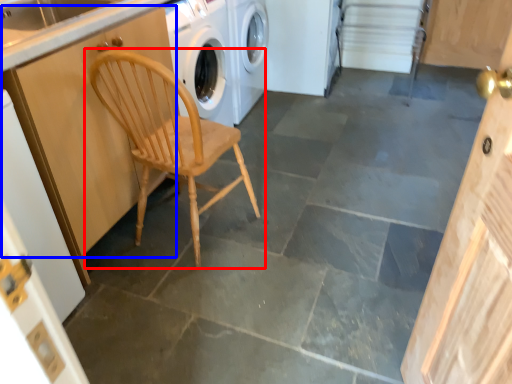
Question: Which of the following is the farthest to the observer, chair (highlighted by a red box) or cabinetry (highlighted by a blue box)?

Choices:
 (A) chair
 (B) cabinetry

Answer: (A)